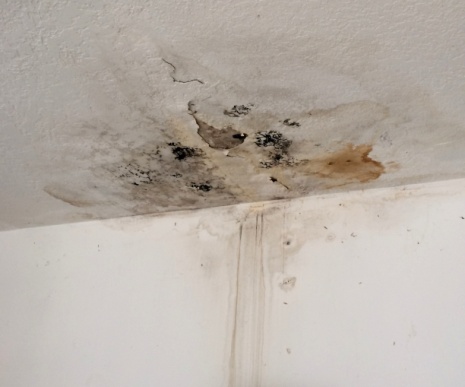
This screenshot has height=387, width=465. Identify the location of empty space on wall right of stains. coord(408,294).